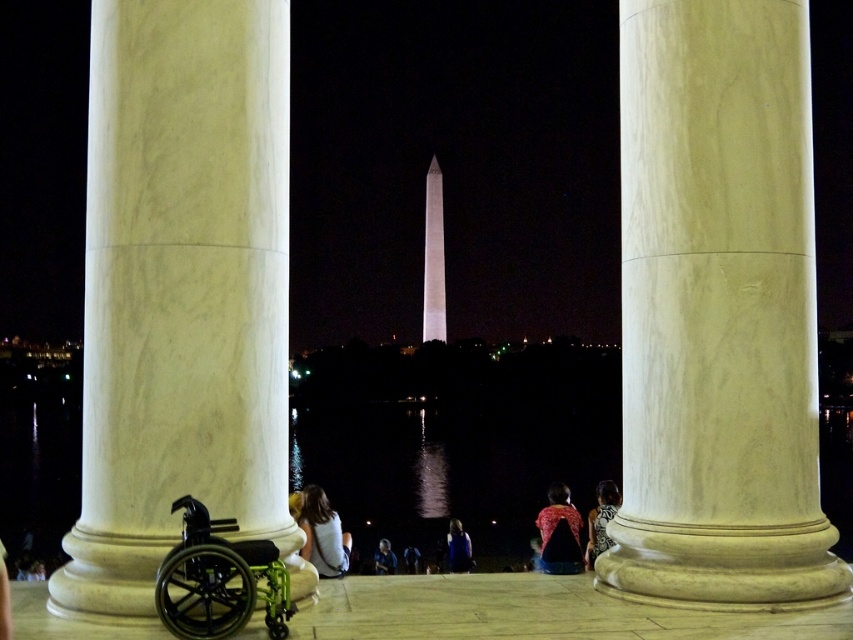
Where is `white marble column at center`? white marble column at center is located at coordinates (718, 310).

The width and height of the screenshot is (853, 640). I want to click on white marble column at center, so click(718, 310).

Who is higher up, red patterned shirt at center or patterned fabric dress at center?

red patterned shirt at center

What do you see at coordinates (560, 532) in the screenshot? I see `red patterned shirt at center` at bounding box center [560, 532].

At what (x,y) coordinates should I click in order to perform the action: click on red patterned shirt at center. Please return your answer as a coordinate pair (x, y). This screenshot has height=640, width=853. Looking at the image, I should click on click(560, 532).

Which is below, white matte shirt at center or patterned fabric dress at center?

patterned fabric dress at center is lower down.

Is white matte shirt at center shorter than patterned fabric dress at center?

Correct, white matte shirt at center is not as tall as patterned fabric dress at center.

I want to click on white matte shirt at center, so click(322, 532).